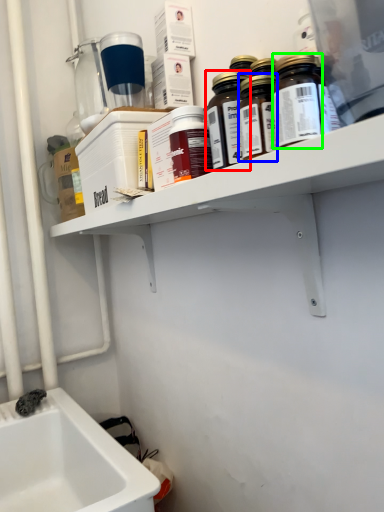
Question: Which object is the closest to the bottle (highlighted by a red box)? Choose among these: bottle (highlighted by a blue box) or bottle (highlighted by a green box).

Choices:
 (A) bottle
 (B) bottle

Answer: (A)